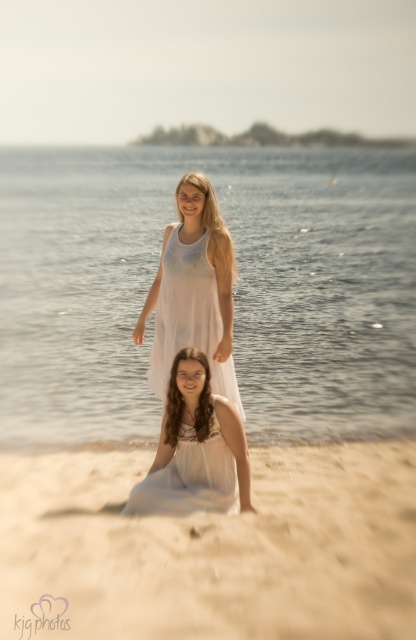
Between beige sandy beach at lower center and white sheer dress at lower center, which one appears on the left side from the viewer's perspective?

Positioned to the left is white sheer dress at lower center.

Can you confirm if beige sandy beach at lower center is shorter than white sheer dress at lower center?

Yes.

The width and height of the screenshot is (416, 640). What do you see at coordinates (213, 548) in the screenshot? I see `beige sandy beach at lower center` at bounding box center [213, 548].

This screenshot has height=640, width=416. Find the location of `beige sandy beach at lower center`. beige sandy beach at lower center is located at coordinates pyautogui.click(x=213, y=548).

Is clear water at center positioned behind white sheer dress at lower center?

Yes, clear water at center is behind white sheer dress at lower center.

Between point (284, 227) and point (200, 476), which one is positioned in front?

Point (200, 476) is in front.

Find the location of a particular element. clear water at center is located at coordinates (233, 289).

The height and width of the screenshot is (640, 416). I want to click on clear water at center, so click(x=233, y=289).

Between beige sandy beach at lower center and white sheer dress at center, which one is positioned higher?

white sheer dress at center

Can you confirm if beige sandy beach at lower center is shorter than white sheer dress at center?

Yes, beige sandy beach at lower center is shorter than white sheer dress at center.

You are a GUI agent. You are given a task and a screenshot of the screen. Output one action in this format:
    pyautogui.click(x=<x>, y=<y>)
    Task: Click on the beige sandy beach at lower center
    This screenshot has width=416, height=640.
    Given the screenshot: What is the action you would take?
    [213, 548]